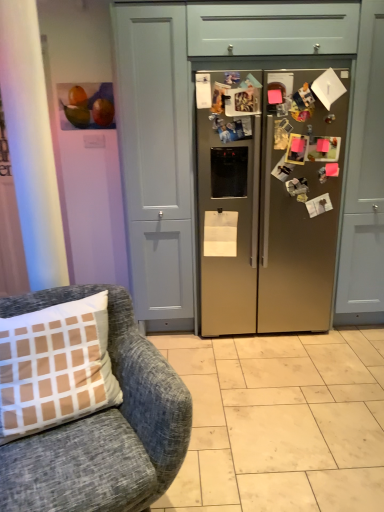
Question: Based on their sizes in the image, would you say matte gray cabinet at left is bigger or smaller than satin metallic refrigerator at center?

Choices:
 (A) big
 (B) small

Answer: (A)

Question: Is matte gray cabinet at left spatially inside satin metallic refrigerator at center, or outside of it?

Choices:
 (A) outside
 (B) inside

Answer: (A)

Question: Considering the real-world distances, which object is farthest from the satin gold refrigerator at center?

Choices:
 (A) matte gray cabinet at left
 (B) textured gray fabric chair at lower left
 (C) matte acrylic painting of fruits at upper left
 (D) matte gray drawer at upper center
 (E) satin metallic refrigerator at center

Answer: (B)

Question: Which object is positioned closest to the satin metallic refrigerator at center?

Choices:
 (A) textured gray fabric chair at lower left
 (B) matte gray drawer at upper center
 (C) matte acrylic painting of fruits at upper left
 (D) matte gray cabinet at left
 (E) satin gold refrigerator at center

Answer: (E)